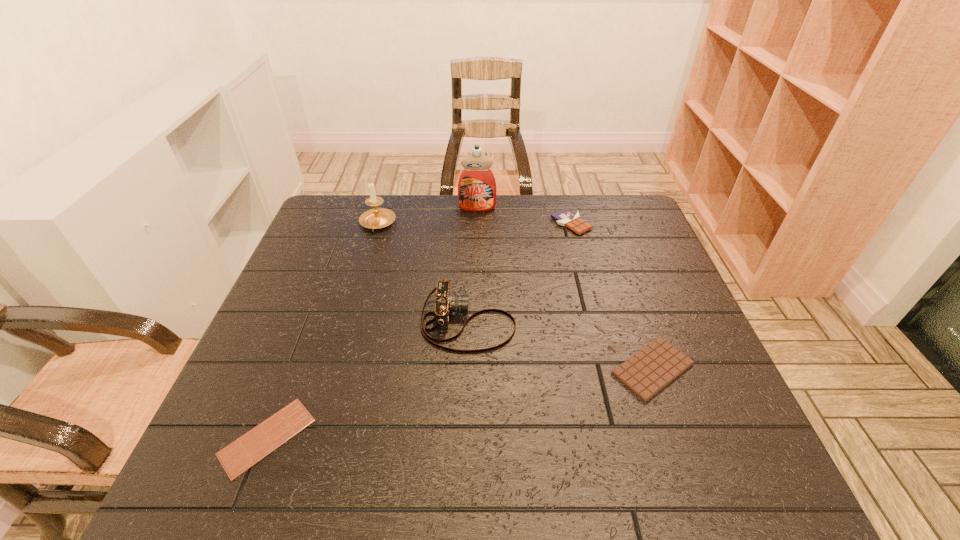
This screenshot has width=960, height=540. I want to click on object that is at the right edge, so click(x=647, y=372).

Where is `object present at the far left corner`? object present at the far left corner is located at coordinates (376, 218).

The height and width of the screenshot is (540, 960). I want to click on object situated at the near left corner, so click(x=243, y=453).

Where is `vacant space at the far edge of the desktop`? vacant space at the far edge of the desktop is located at coordinates (397, 208).

In the image, there is a desktop. Where is `vacant space at the near edge`? This screenshot has height=540, width=960. vacant space at the near edge is located at coordinates (611, 452).

Identify the location of blank space at the left edge. point(297,325).

This screenshot has height=540, width=960. I want to click on vacant region at the right edge of the desktop, so click(x=684, y=295).

The height and width of the screenshot is (540, 960). Identify the location of free space at the far left corner of the desktop. (316, 231).

In the image, there is a desktop. Identify the location of vacant space at the near left corner. The width and height of the screenshot is (960, 540). (217, 481).

Locate an element on the screen. Image resolution: width=960 pixels, height=540 pixels. vacant region at the far right corner of the desktop is located at coordinates (624, 212).